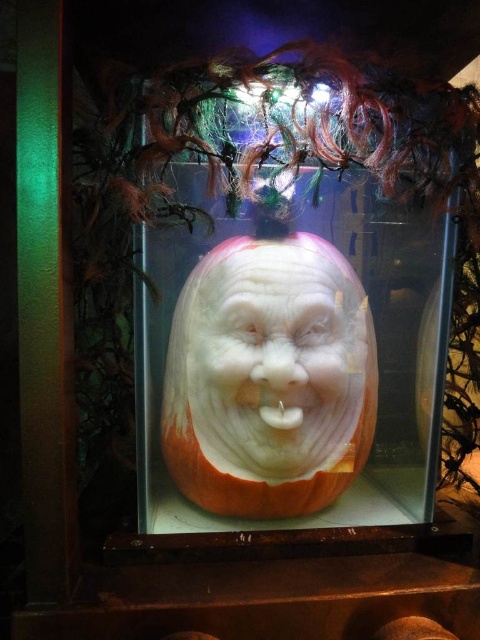
Does transparent glass pumpkin at center have a smaller size compared to smooth white pumpkin at center?

No, transparent glass pumpkin at center is not smaller than smooth white pumpkin at center.

Between transparent glass pumpkin at center and smooth white pumpkin at center, which one appears on the right side from the viewer's perspective?

transparent glass pumpkin at center

This screenshot has width=480, height=640. In order to click on transparent glass pumpkin at center in this screenshot , I will do `click(298, 356)`.

Where is `transparent glass pumpkin at center`? This screenshot has height=640, width=480. transparent glass pumpkin at center is located at coordinates (298, 356).

Does transparent glass pumpkin at center appear on the left side of white carved nose at center?

No, transparent glass pumpkin at center is not to the left of white carved nose at center.

Does point (203, 509) come in front of point (285, 385)?

No.

You are a GUI agent. You are given a task and a screenshot of the screen. Output one action in this format:
    pyautogui.click(x=<x>, y=<y>)
    Task: Click on the transparent glass pumpkin at center
    
    Given the screenshot: What is the action you would take?
    pyautogui.click(x=298, y=356)

Is smooth white pumpkin at center positioned behind white carved nose at center?

Yes, it is.

Is smooth white pumpkin at center to the right of white carved nose at center from the viewer's perspective?

Yes, smooth white pumpkin at center is to the right of white carved nose at center.

This screenshot has height=640, width=480. Identify the location of smooth white pumpkin at center. (276, 358).

The height and width of the screenshot is (640, 480). I want to click on smooth white pumpkin at center, so click(276, 358).